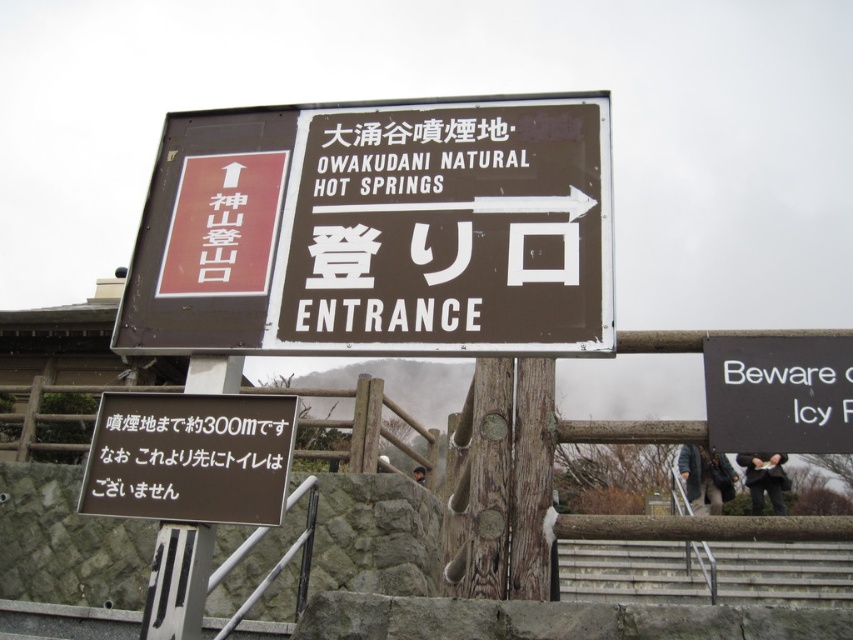
Can you confirm if brownmaterial/texturesign at center is positioned above black plastic sign at upper right?

Indeed, brownmaterial/texturesign at center is positioned over black plastic sign at upper right.

What do you see at coordinates (376, 230) in the screenshot? The image size is (853, 640). I see `brownmaterial/texturesign at center` at bounding box center [376, 230].

This screenshot has height=640, width=853. I want to click on brownmaterial/texturesign at center, so click(x=376, y=230).

Is brown wooden sign at lower center to the left of black plastic sign at upper right from the viewer's perspective?

Correct, you'll find brown wooden sign at lower center to the left of black plastic sign at upper right.

Can you confirm if brown wooden sign at lower center is shorter than black plastic sign at upper right?

Yes, brown wooden sign at lower center is shorter than black plastic sign at upper right.

What are the coordinates of `brown wooden sign at lower center` in the screenshot? It's located at (189, 458).

Is point (267, 324) positioned before point (258, 403)?

No, (267, 324) is further to viewer.

Is brownmaterial/texturesign at center above brown wooden sign at lower center?

Indeed, brownmaterial/texturesign at center is positioned over brown wooden sign at lower center.

Identify the location of brownmaterial/texturesign at center. This screenshot has height=640, width=853. (376, 230).